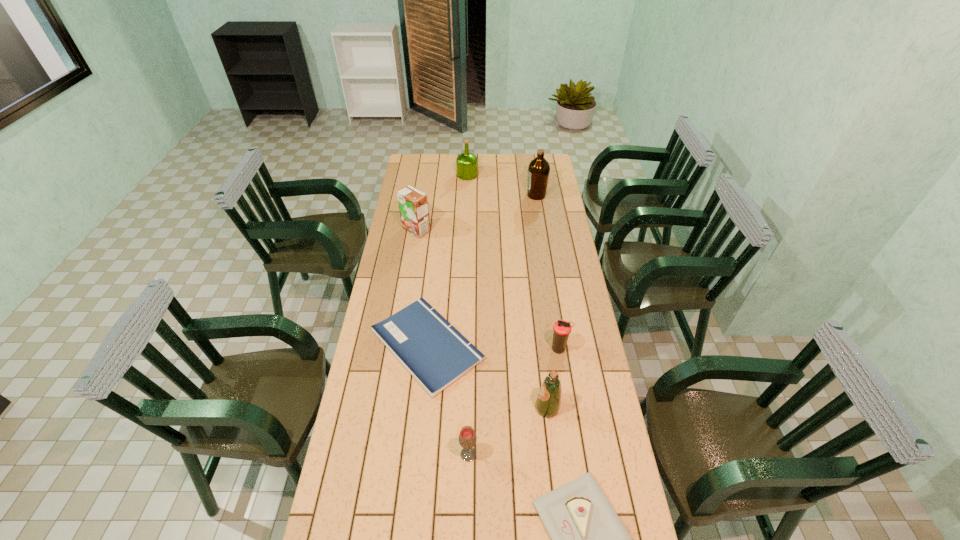
Locate an element on the screen. This screenshot has width=960, height=540. the seventh nearest object is located at coordinates (539, 169).

The image size is (960, 540). In order to click on the tallest olive oil in this screenshot , I will do [539, 169].

Find the location of a particular element. Image resolution: width=960 pixels, height=540 pixels. the sixth nearest object is located at coordinates (413, 204).

You are a GUI agent. You are given a task and a screenshot of the screen. Output one action in this format:
    pyautogui.click(x=<x>, y=<y>)
    Task: Click on the leftmost olive oil
    Image resolution: width=960 pixels, height=540 pixels.
    Given the screenshot: What is the action you would take?
    pyautogui.click(x=466, y=163)

Find the location of a particular element. the farthest object is located at coordinates (466, 163).

Where is `the nearest olive oil`? the nearest olive oil is located at coordinates (548, 402).

Locate an element on the screen. This screenshot has height=540, width=960. thermos bottle is located at coordinates (562, 328).

Locate an element on the screen. The image size is (960, 540). glass drink container is located at coordinates (467, 438).

Image resolution: width=960 pixels, height=540 pixels. In order to click on paperback book in this screenshot , I will do `click(435, 353)`.

I want to click on vacant region located on the label of the second farthest olive oil, so tap(511, 195).